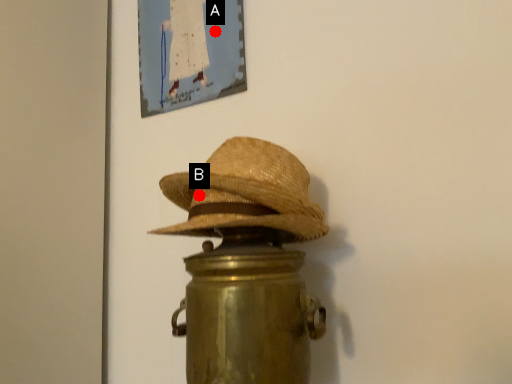
Question: Two points are circled on the image, labeled by A and B beside each circle. Among these points, which one is nearest to the camera?

Choices:
 (A) A is closer
 (B) B is closer

Answer: (B)